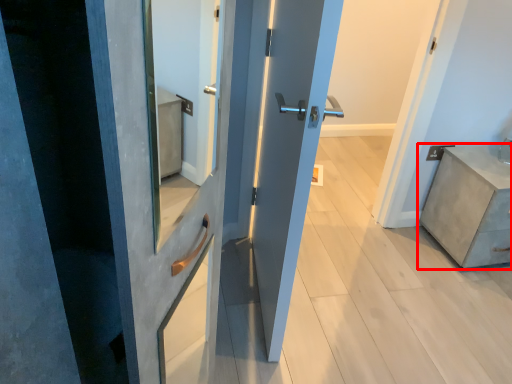
Question: Observing the image, what is the correct spatial positioning of chest of drawers (annotated by the red box) in reference to door?

Choices:
 (A) right
 (B) left

Answer: (A)